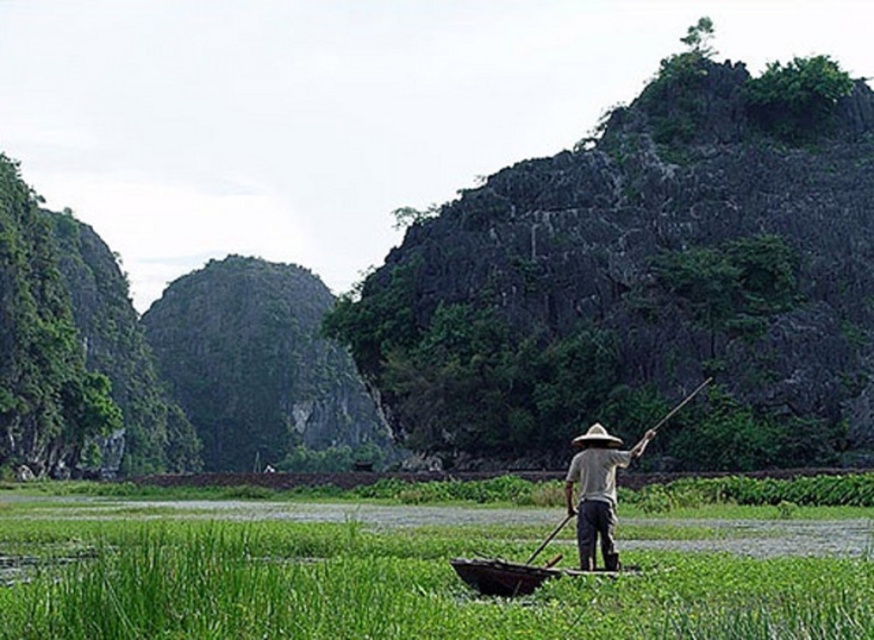
You are a hiker who wants to take a photo of the brown straw hat at center and the green grass at lower center. Which object should you focus on first if you want to capture both in the same frame without moving the camera?

The green grass at lower center is taller than the brown straw hat at center, so you should focus on the green grass at lower center first to ensure both are in focus.

You are standing at the point marked as point [415,586] in the image. What do you see immediately around you?

You see green grass at lower center immediately around you.